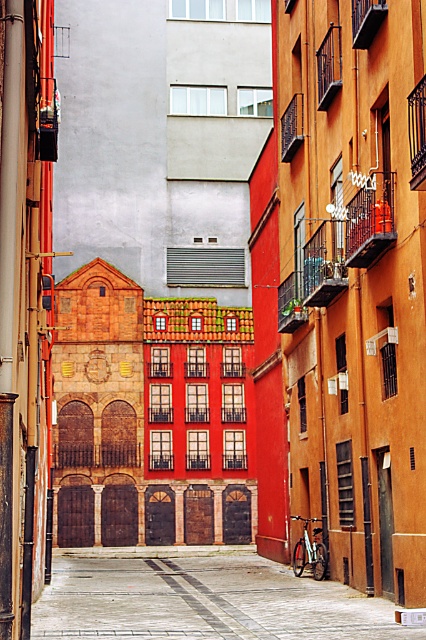
Between point (129, 552) and point (313, 552), which one is positioned behind?

Point (129, 552)

Who is higher up, smooth concrete pavement at center or silver metallic bicycle at center?

silver metallic bicycle at center

Is point (331, 634) positioned in front of point (316, 579)?

Yes, point (331, 634) is in front of point (316, 579).

You are a GUI agent. You are given a task and a screenshot of the screen. Output one action in this format:
    pyautogui.click(x=<x>, y=<y>)
    Task: Click on the smooth concrete pavement at center
    
    Given the screenshot: What is the action you would take?
    pyautogui.click(x=203, y=602)